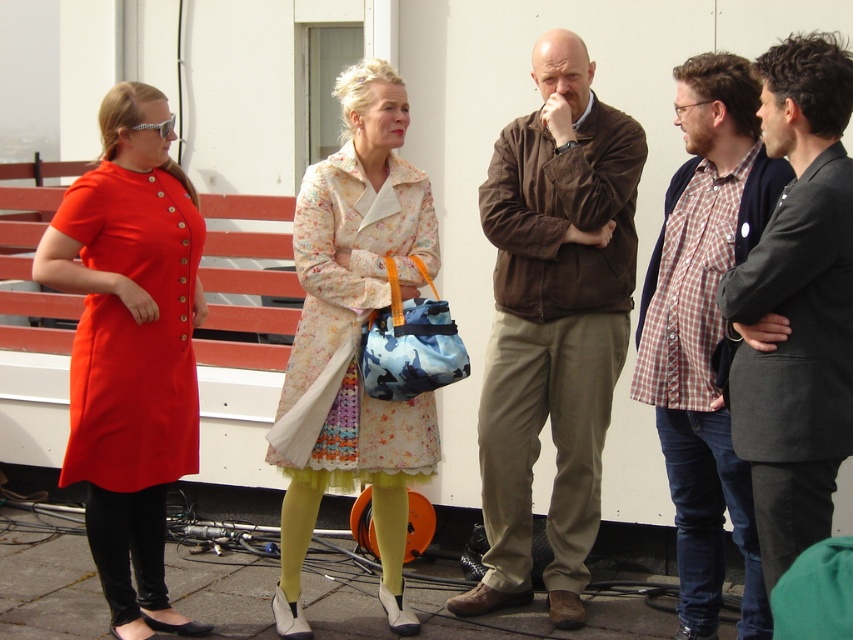
Question: Which point appears farthest from the camera in this image?

Choices:
 (A) (613, 266)
 (B) (376, 417)

Answer: (A)

Question: Can you confirm if brown suede jacket at center is bigger than matte orange dress at left?

Choices:
 (A) yes
 (B) no

Answer: (A)

Question: Is floral-patterned coat at center smaller than checkered fabric shirt at center?

Choices:
 (A) yes
 (B) no

Answer: (A)

Question: Which object is the farthest from the checkered fabric shirt at center?

Choices:
 (A) floral-patterned coat at center
 (B) matte orange dress at left
 (C) brown suede jacket at center
 (D) dark gray suit at right

Answer: (B)

Question: Which object appears closest to the camera in this image?

Choices:
 (A) checkered fabric shirt at center
 (B) dark gray suit at right
 (C) floral-patterned coat at center

Answer: (B)

Question: Can you confirm if matte orange dress at left is smaller than dark gray suit at right?

Choices:
 (A) no
 (B) yes

Answer: (A)